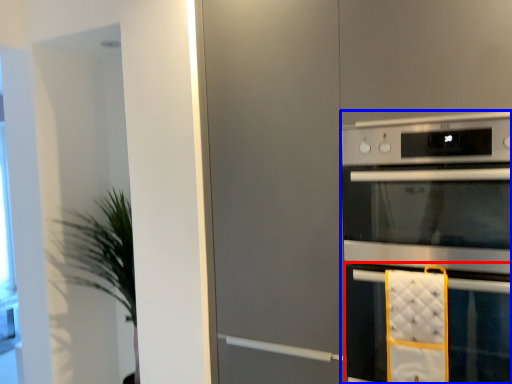
Question: Which of the following is the farthest to the observer, oven (highlighted by a red box) or home appliance (highlighted by a blue box)?

Choices:
 (A) oven
 (B) home appliance

Answer: (A)